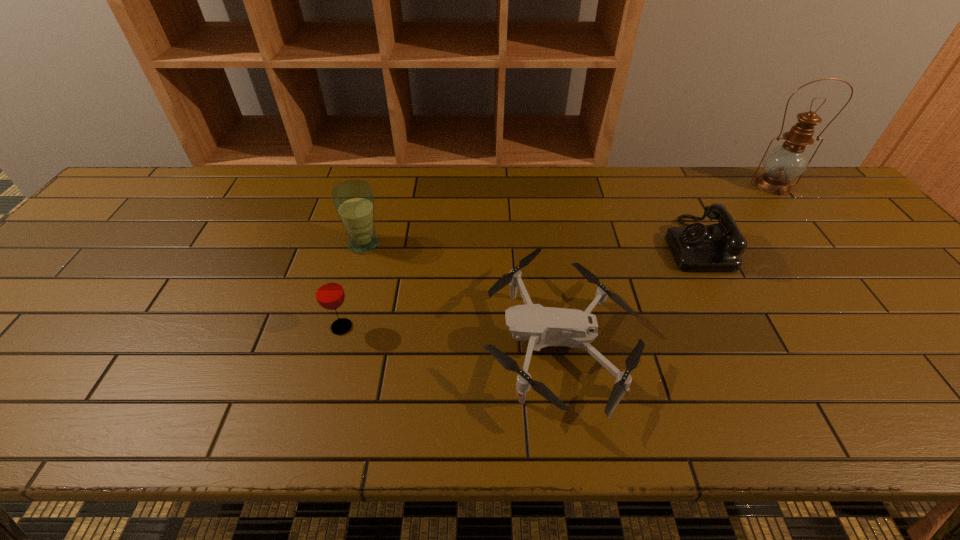
This screenshot has width=960, height=540. In order to click on object that is at the far right corner in this screenshot , I will do [785, 162].

The width and height of the screenshot is (960, 540). I want to click on vacant area at the far edge of the desktop, so click(688, 190).

The image size is (960, 540). Find the location of `vacant space at the near edge of the desktop`. vacant space at the near edge of the desktop is located at coordinates (639, 402).

The width and height of the screenshot is (960, 540). I want to click on vacant space at the right edge of the desktop, so click(924, 301).

This screenshot has width=960, height=540. In order to click on free space at the far right corner of the desktop in this screenshot , I will do `click(823, 208)`.

This screenshot has height=540, width=960. What are the coordinates of `free space between the oil lamp and the nearer glass` in the screenshot? It's located at (558, 256).

Where is `free spot between the nearer glass and the farther glass`? free spot between the nearer glass and the farther glass is located at coordinates (353, 285).

Identify the location of vacant space that's between the farther glass and the tallest object. (568, 214).

The height and width of the screenshot is (540, 960). I want to click on vacant area that lies between the farthest object and the nearer glass, so click(x=558, y=256).

Identify the location of vacant point located between the farther glass and the nearer glass. Image resolution: width=960 pixels, height=540 pixels. (353, 285).